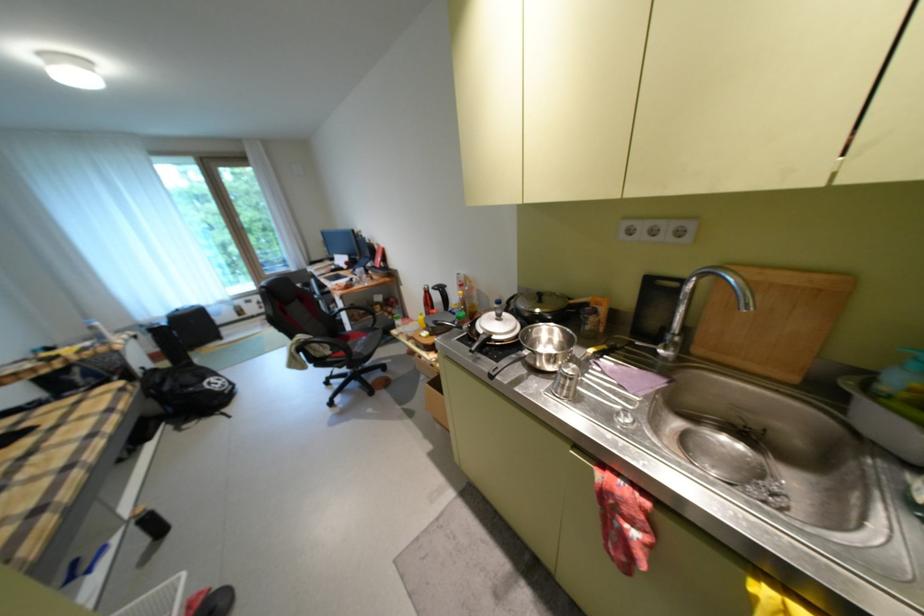
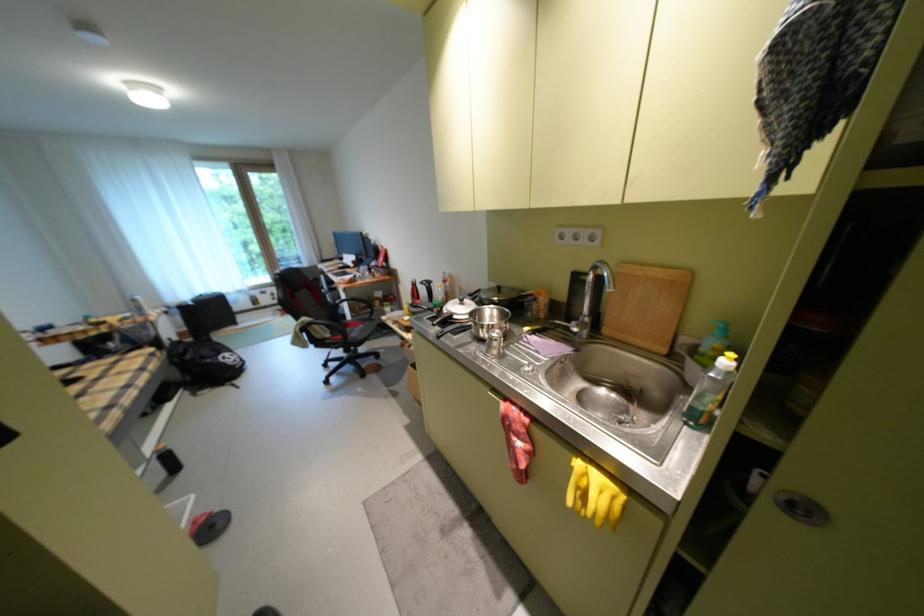
Find the pixel in the second image that matches point 226,383 in the first image.

(239, 358)